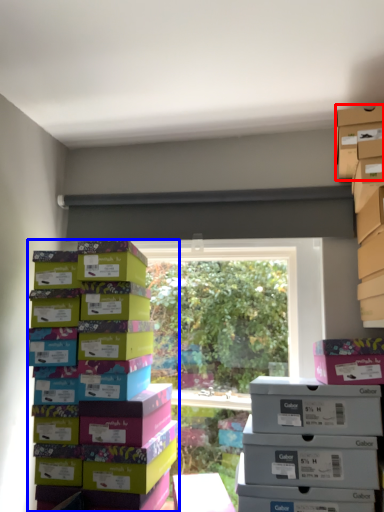
Question: Which object is closer to the camera taking this photo, storage box (highlighted by a red box) or box (highlighted by a blue box)?

Choices:
 (A) storage box
 (B) box

Answer: (B)